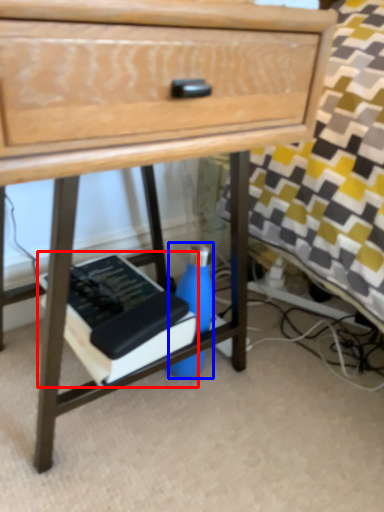
Question: Which object appears closest to the camera in this image, paperback book (highlighted by a red box) or bottle (highlighted by a blue box)?

Choices:
 (A) paperback book
 (B) bottle

Answer: (A)